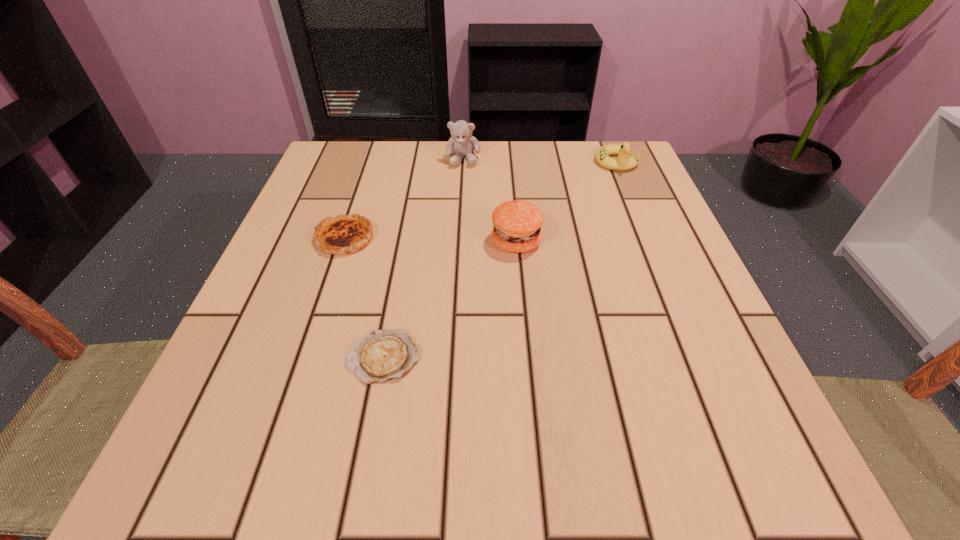
Where is `vacant region at the right edge of the desktop`? The height and width of the screenshot is (540, 960). vacant region at the right edge of the desktop is located at coordinates (660, 327).

Locate an element on the screen. free space at the far left corner is located at coordinates (326, 148).

You are a GUI agent. You are given a task and a screenshot of the screen. Output one action in this format:
    pyautogui.click(x=<x>, y=<y>)
    Task: Click on the vacant point at the far right corner
    The image size is (960, 540).
    Given the screenshot: What is the action you would take?
    pyautogui.click(x=636, y=195)

You are a GUI agent. You are given a task and a screenshot of the screen. Output one action in this format:
    pyautogui.click(x=<x>, y=<y>)
    Task: Click on the free region at the near right corner
    The image size is (960, 540).
    Given the screenshot: What is the action you would take?
    pyautogui.click(x=697, y=431)

Locate an element on the screen. The height and width of the screenshot is (540, 960). unoccupied area between the left quiche and the duckling is located at coordinates (481, 200).

The width and height of the screenshot is (960, 540). Find the location of `vacant area that lies between the nearest object and the taller quiche`. vacant area that lies between the nearest object and the taller quiche is located at coordinates (364, 298).

Locate an element on the screen. The width and height of the screenshot is (960, 540). unoccupied position between the taller quiche and the third object from left to right is located at coordinates (404, 198).

Identify the location of free space between the third object from left to right and the patty. (x=490, y=200).

Locate an element on the screen. The image size is (960, 540). vacant space that is in between the teddy bear and the right quiche is located at coordinates (423, 258).

The image size is (960, 540). I want to click on free space between the nearer quiche and the tallest object, so click(423, 258).